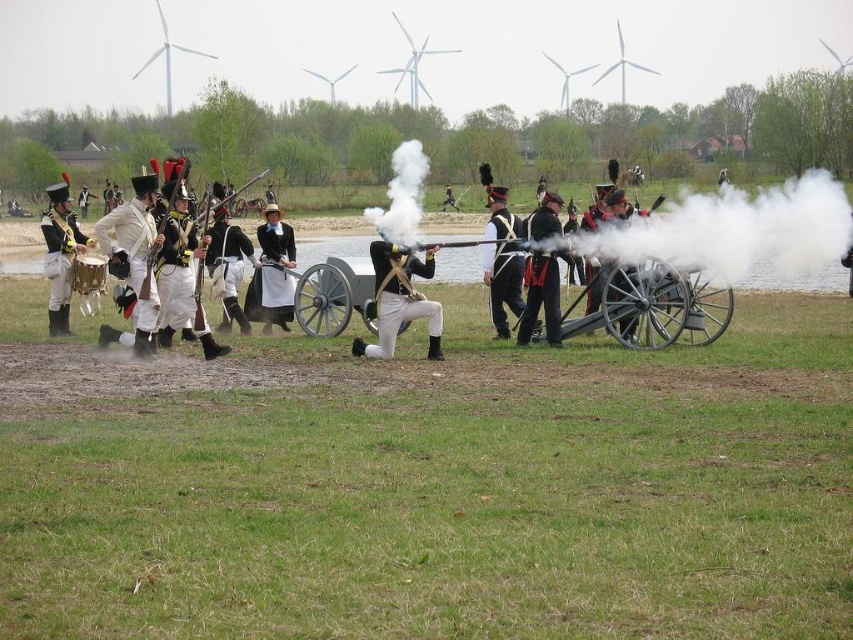
Is shiny black uniform at center bigger than white cotton uniform at center?

Yes, shiny black uniform at center is bigger than white cotton uniform at center.

Measure the distance between shiny black uniform at center and camera.

17.42 meters

Identify the location of shiny black uniform at center. (503, 264).

Is white cotton uniform at left above matte black uniform at left?

Yes, white cotton uniform at left is above matte black uniform at left.

Is point (187, 276) closer to camera compared to point (51, 232)?

That is True.

Where is `white cotton uniform at left`? The image size is (853, 640). white cotton uniform at left is located at coordinates (140, 252).

At what (x,y) coordinates should I click in order to perform the action: click on white cotton uniform at left. Please return your answer as a coordinate pair (x, y). This screenshot has height=640, width=853. Looking at the image, I should click on (140, 252).

Is matte black uniform at left positioned before shiny black uniform at center?

That is False.

Does matte black uniform at left appear on the right side of shiny black uniform at center?

Incorrect, matte black uniform at left is not on the right side of shiny black uniform at center.

Which is in front, point (45, 244) or point (517, 224)?

Point (517, 224) is more forward.

Image resolution: width=853 pixels, height=640 pixels. What are the coordinates of `matte black uniform at left` in the screenshot? It's located at (61, 253).